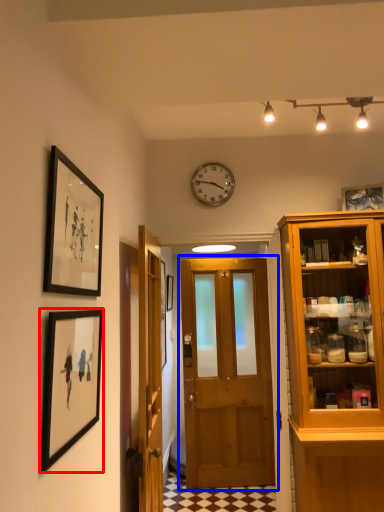
Question: Which object appears closest to the camera in this image, picture frame (highlighted by a red box) or door (highlighted by a blue box)?

Choices:
 (A) picture frame
 (B) door

Answer: (A)